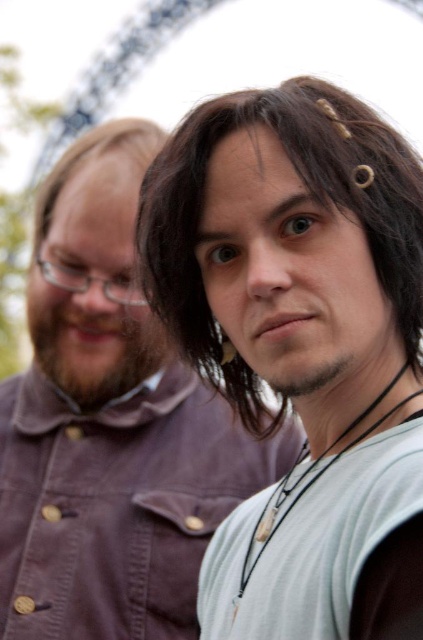
You are standing in an amusement park and see the two people in the image. The point at coordinates point (109, 426) is marked. Which object does this point correspond to?

The point at coordinates point (109, 426) corresponds to the matte brown shirt at center.